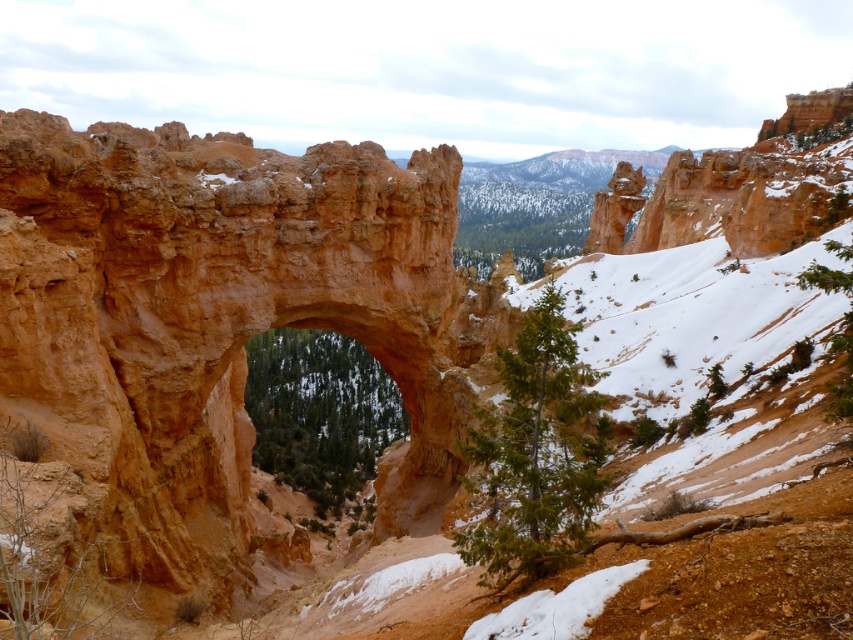
You are an environmental scientist assessing the landscape. You notice the green matte tree at center and the green textured tree at lower right. Which tree would likely have a larger canopy spread, based on their height and positioning?

The green matte tree at center is much taller than the green textured tree at lower right, so it likely has a larger canopy spread due to its greater height.

You are standing at the base of the sandstone arch and want to walk towards the two points marked in the image. Which point, point (x=544, y=461) or point (x=827, y=339), is closer to you?

Point (x=544, y=461) is closer to you than point (x=827, y=339).

You are planning to plant a new tree in this landscape. The new tree must be placed so that it does not block the view of the green textured tree at center from the green textured tree at lower right. Where should you place the new tree?

The green textured tree at center is positioned under the green textured tree at lower right. To avoid blocking the view between them, the new tree should be placed either to the side of the two existing trees or behind them, ensuring it does not obstruct the line of sight between the green textured tree at center and the green textured tree at lower right.